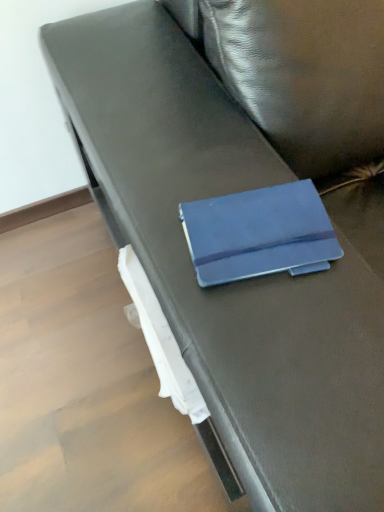
The height and width of the screenshot is (512, 384). Describe the element at coordinates (259, 234) in the screenshot. I see `blue matte notebook at center` at that location.

Locate an element on the screen. blue matte notebook at center is located at coordinates (259, 234).

Find the location of `blue matte notebook at center`. blue matte notebook at center is located at coordinates (259, 234).